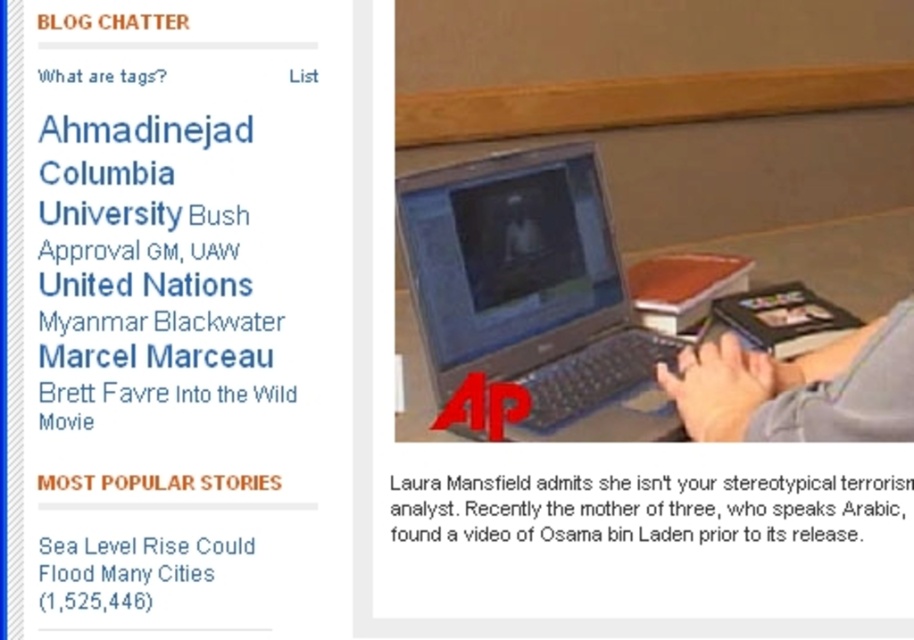
The width and height of the screenshot is (914, 640). Find the location of `matte plastic laptop at center`. matte plastic laptop at center is located at coordinates (532, 292).

Who is more distant from viewer, (560, 348) or (638, 540)?

The point (560, 348) is behind.

Does point (564, 365) lie in front of point (641, 499)?

No, it is behind (641, 499).

In order to click on matte plastic laptop at center in this screenshot , I will do `click(532, 292)`.

Does white paper at lower center have a greater height compared to white text on black background at upper left?

Indeed, white paper at lower center has a greater height compared to white text on black background at upper left.

Can you confirm if white paper at lower center is bigger than white text on black background at upper left?

Yes, white paper at lower center is bigger than white text on black background at upper left.

Is point (640, 490) more distant than point (71, 605)?

That is True.

At what (x,y) coordinates should I click in order to perform the action: click on white paper at lower center. Please return your answer as a coordinate pair (x, y). Looking at the image, I should click on (665, 502).

Is matte plastic laptop at center thinner than white text on black background at upper left?

Incorrect, matte plastic laptop at center's width is not less than white text on black background at upper left's.

Identify the location of matte plastic laptop at center. (532, 292).